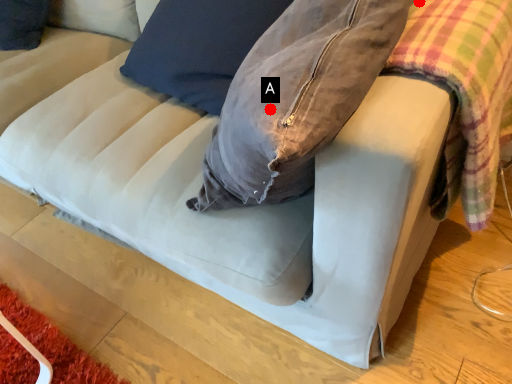
Question: Two points are circled on the image, labeled by A and B beside each circle. Which point is closer to the camera?

Choices:
 (A) A is closer
 (B) B is closer

Answer: (A)